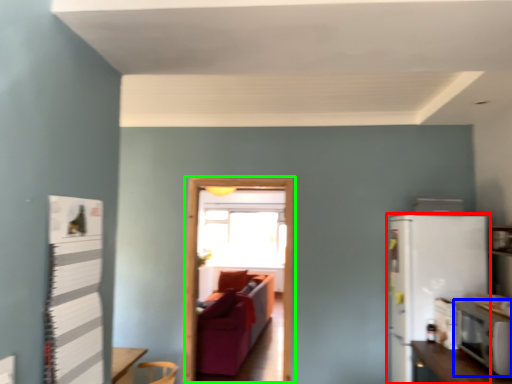
Question: Estimate the real-world distances between objects in this image. Which object is closer to refrigerator (highlighted by a red box), appliance (highlighted by a blue box) or glass door (highlighted by a green box)?

Choices:
 (A) appliance
 (B) glass door

Answer: (A)